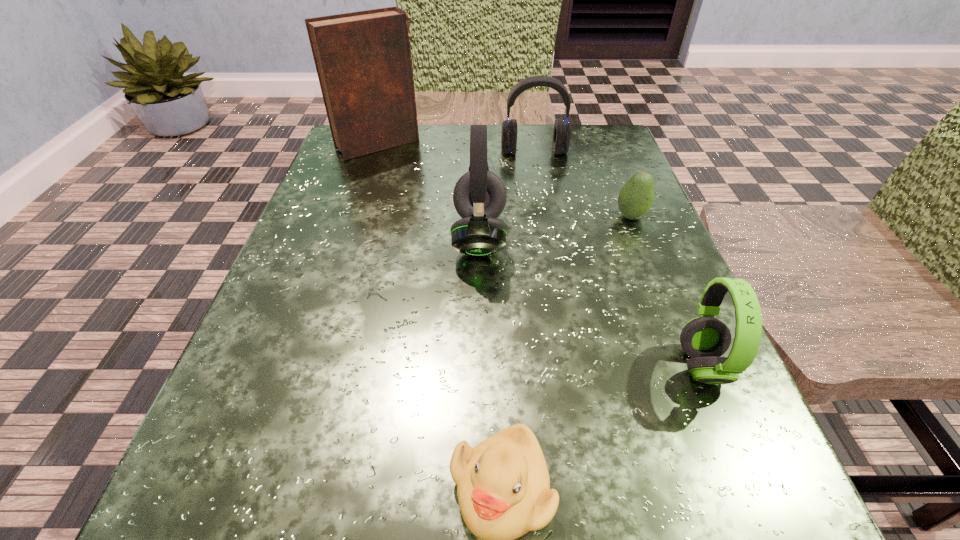
Find the location of a particular element. The height and width of the screenshot is (540, 960). vacant space located on the headband of the farthest headset is located at coordinates (554, 265).

Where is `free location located 0.340m on the back of the rightmost headset`? Image resolution: width=960 pixels, height=540 pixels. free location located 0.340m on the back of the rightmost headset is located at coordinates (629, 192).

Identify the location of free region located on the front of the avocado. (680, 341).

At what (x,y) coordinates should I click in order to perform the action: click on Bible located in the far edge section of the desktop. Please return your answer as a coordinate pair (x, y). Looking at the image, I should click on (363, 59).

At what (x,y) coordinates should I click in order to perform the action: click on headset situated at the far edge. Please return your answer as a coordinate pair (x, y). The height and width of the screenshot is (540, 960). Looking at the image, I should click on (x=562, y=131).

This screenshot has height=540, width=960. Find the location of `object located in the left edge section of the desktop`. object located in the left edge section of the desktop is located at coordinates (x=363, y=59).

The height and width of the screenshot is (540, 960). I want to click on avocado present at the right edge, so click(635, 199).

Image resolution: width=960 pixels, height=540 pixels. Identify the location of object situated at the far left corner. (363, 59).

The width and height of the screenshot is (960, 540). Find the location of `object that is at the far right corner`. object that is at the far right corner is located at coordinates (562, 131).

The image size is (960, 540). In the image, there is a desktop. Identify the location of vacant space at the far edge. (437, 136).